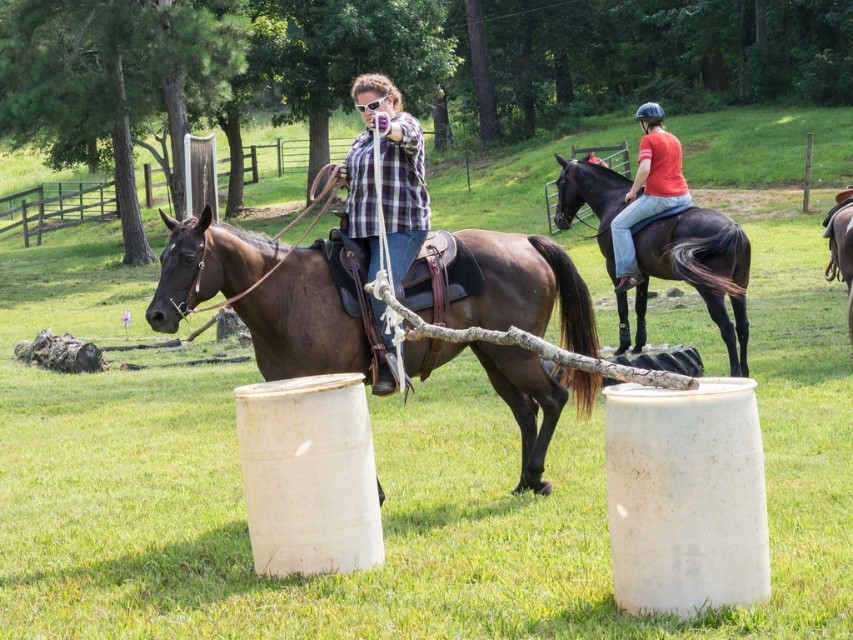
You are a photographer standing in the field and want to take a photo of the shiny black horse at upper right and the brown leather horse at right. Which horse is closer to the camera?

The shiny black horse at upper right is positioned under the brown leather horse at right, so the brown leather horse at right is closer to the camera.

You are standing at the origin point of the coordinate system in the image. The brown leather horse at center is located at point (302, 321). If you want to walk directly towards the brown leather horse at center, which direction should you head?

Since the coordinate system places the origin at the bottom left corner of the image, moving towards the point (302, 321) would mean heading northeast. Therefore, you should head northeast to reach the brown leather horse at center.